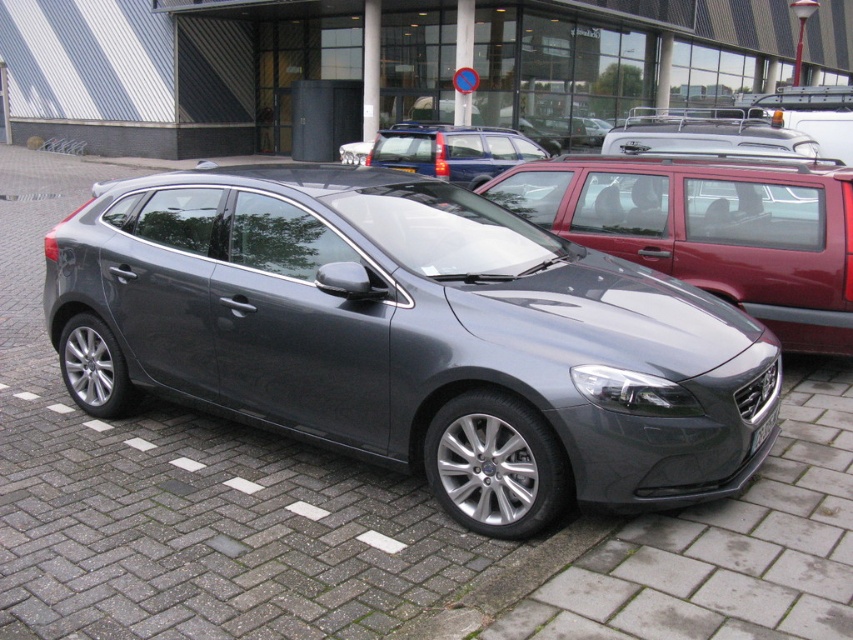
Question: Where is metallic red minivan at center located in relation to white plastic license plate at center in the image?

Choices:
 (A) above
 (B) below

Answer: (A)

Question: Estimate the real-world distances between objects in this image. Which object is closer to the metallic red minivan at center?

Choices:
 (A) white plastic license plate at center
 (B) satin metallic hatchback at center

Answer: (A)

Question: Does satin metallic hatchback at center appear under metallic red minivan at center?

Choices:
 (A) yes
 (B) no

Answer: (A)

Question: Which point is farther to the camera?

Choices:
 (A) (750, 448)
 (B) (450, 129)

Answer: (B)

Question: Estimate the real-world distances between objects in this image. Which object is closer to the white plastic license plate at center?

Choices:
 (A) satin metallic hatchback at center
 (B) metallic red minivan at center
 (C) satin blue car at center

Answer: (A)

Question: Is satin metallic hatchback at center below satin blue car at center?

Choices:
 (A) yes
 (B) no

Answer: (A)